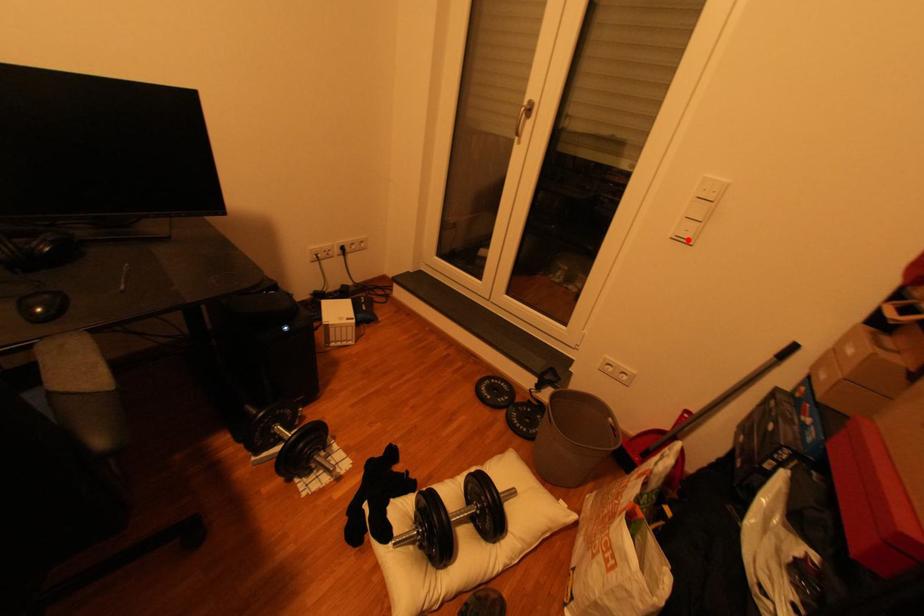
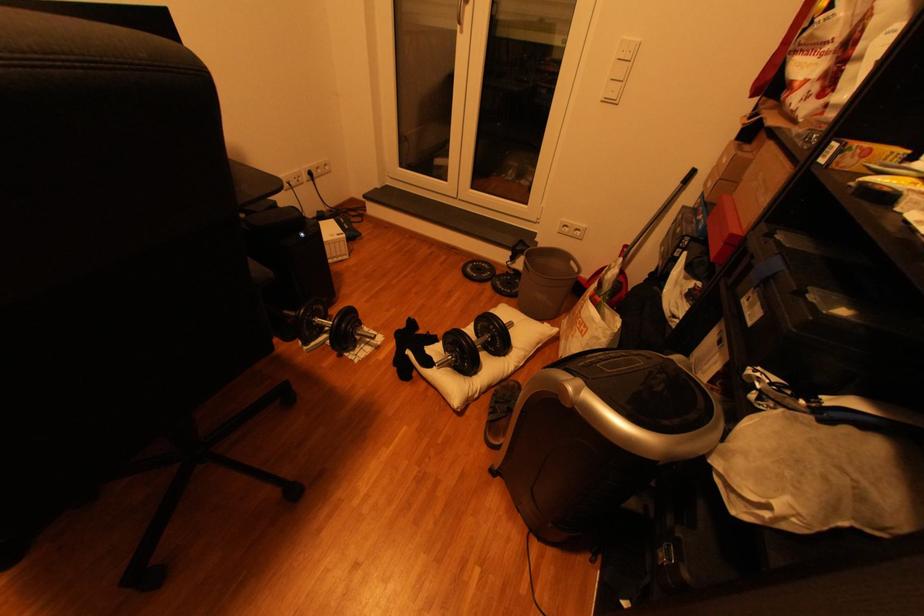
Locate, in the second image, the point that corresponds to the highlighted location in the first image.

(614, 100)